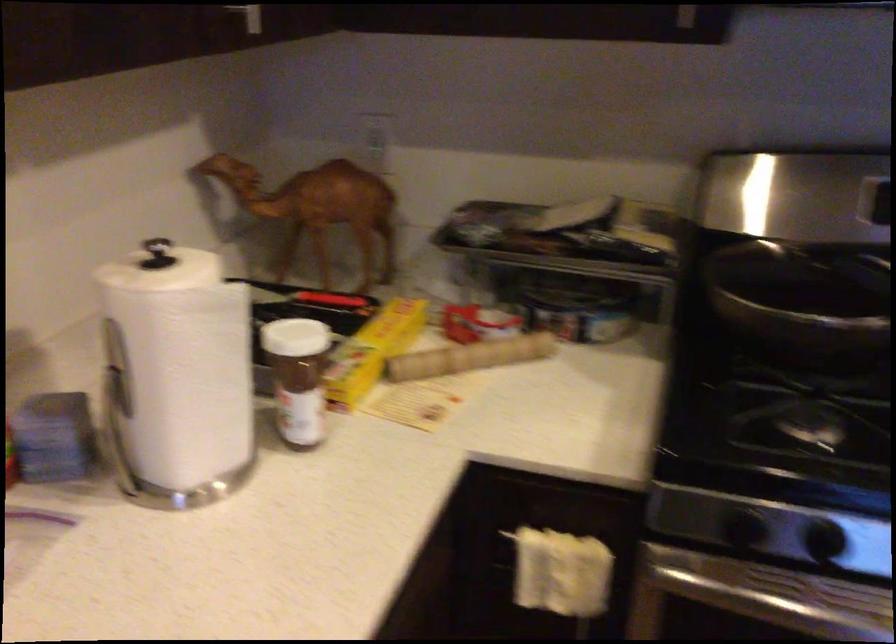
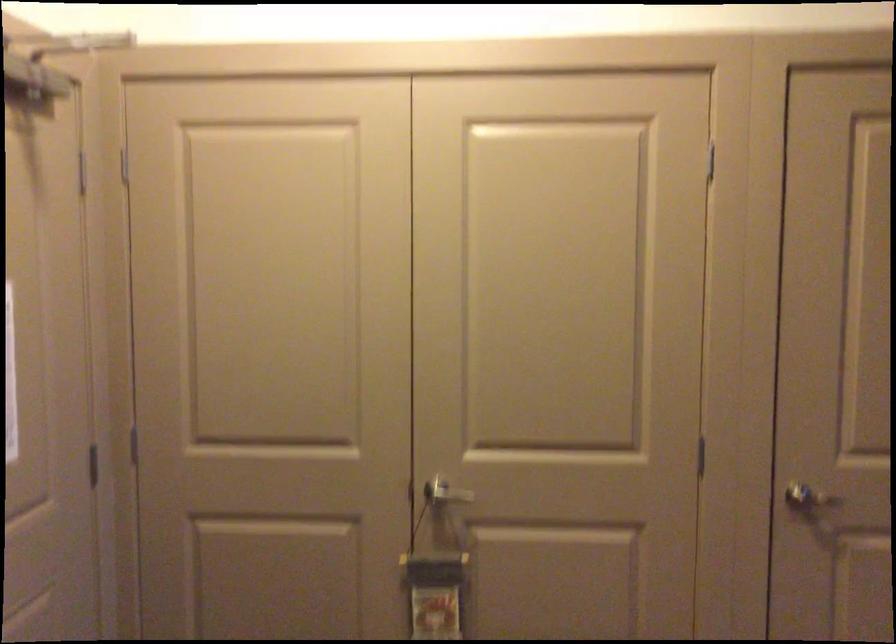
Question: Based on the continuous images, in which direction is the camera rotating? Reply with the corresponding letter.

Choices:
 (A) Left
 (B) Right
 (C) Up
 (D) Down

Answer: (B)